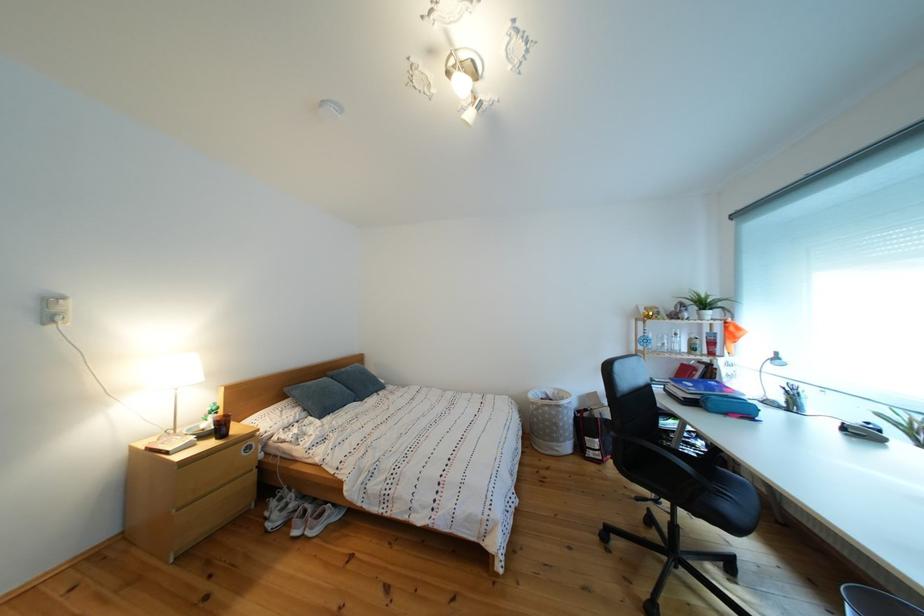
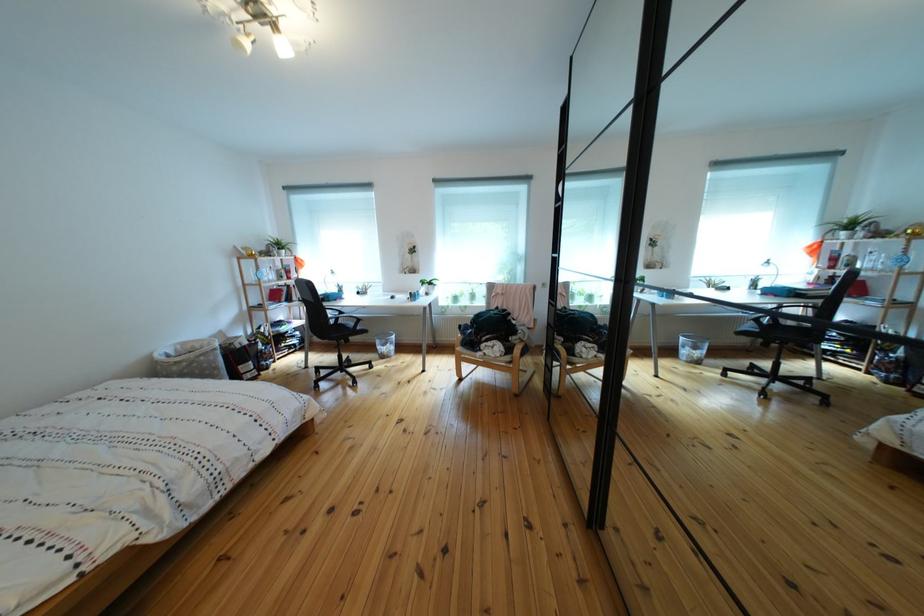
Locate, in the second image, the point that corresponds to (x=719, y=416) in the first image.

(341, 307)